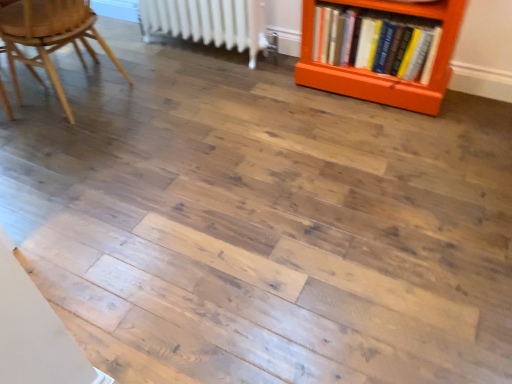
Find the location of a particular element. free location in front of white metallic radiator at upper center is located at coordinates (211, 100).